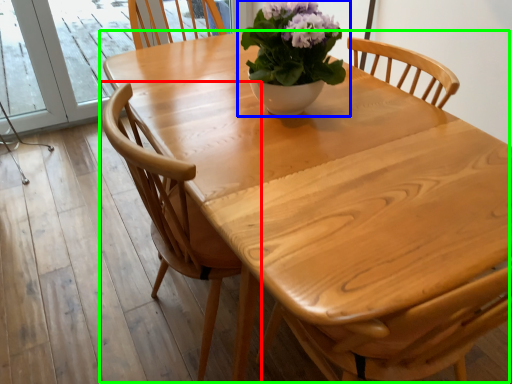
Question: Considering the real-world distances, which object is farthest from chair (highlighted by a red box)? houseplant (highlighted by a blue box) or kitchen & dining room table (highlighted by a green box)?

Choices:
 (A) houseplant
 (B) kitchen & dining room table

Answer: (A)